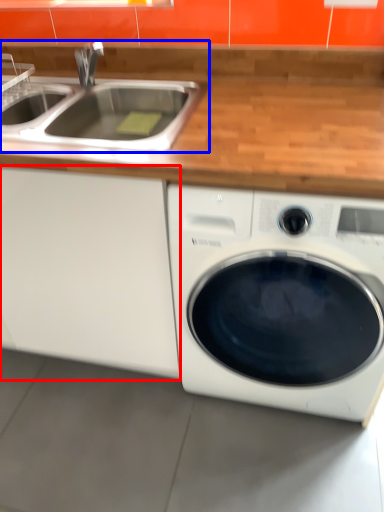
Question: Among these objects, which one is nearest to the camera, cabinetry (highlighted by a red box) or sink (highlighted by a blue box)?

Choices:
 (A) cabinetry
 (B) sink

Answer: (A)